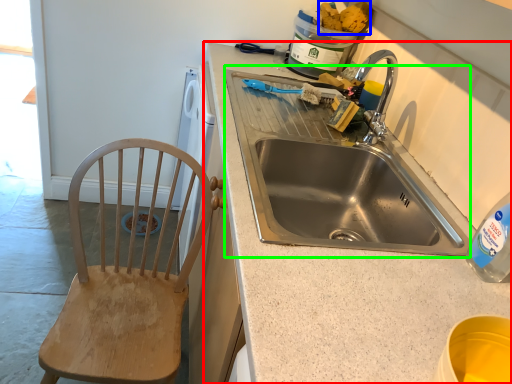
Question: Considering the real-world distances, which object is closest to countertop (highlighted by a red box)? food (highlighted by a blue box) or sink (highlighted by a green box).

Choices:
 (A) food
 (B) sink

Answer: (B)